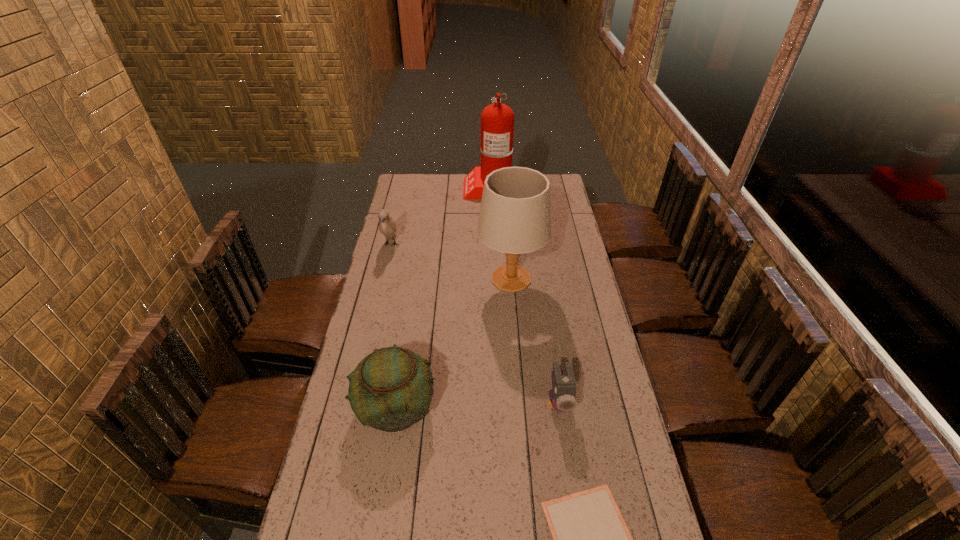
You are a GUI agent. You are given a task and a screenshot of the screen. Output one action in this format:
    pyautogui.click(x=<x>, y=<y>)
    Task: Click on the blank space located on the left of the second tallest object
    Image resolution: width=960 pixels, height=540 pixels.
    Given the screenshot: What is the action you would take?
    pyautogui.click(x=422, y=279)

This screenshot has height=540, width=960. In order to click on blank area located at the beak of the taller bird in this screenshot , I will do click(x=384, y=273).

Find the location of `vacant area located on the right of the pottery`. vacant area located on the right of the pottery is located at coordinates coord(470,406).

Where is `free space located 0.280m at the beak of the right bird`? The image size is (960, 540). free space located 0.280m at the beak of the right bird is located at coordinates [x=577, y=525].

I want to click on object at the far edge, so click(497, 120).

Find the location of a particular element. This screenshot has height=540, width=960. bird that is at the left edge is located at coordinates (387, 226).

Find the location of a particular element. pottery situated at the left edge is located at coordinates (391, 388).

The height and width of the screenshot is (540, 960). In order to click on free space at the left edge of the desktop in this screenshot , I will do `click(404, 250)`.

Where is `free space at the right edge of the desktop`? This screenshot has width=960, height=540. free space at the right edge of the desktop is located at coordinates (570, 308).

You are a GUI agent. You are given a task and a screenshot of the screen. Output one action in this format:
    pyautogui.click(x=<x>, y=<y>)
    Task: Click on the free point between the fire extinguisher and the pottery
    Image resolution: width=960 pixels, height=540 pixels.
    Given the screenshot: What is the action you would take?
    pyautogui.click(x=444, y=296)